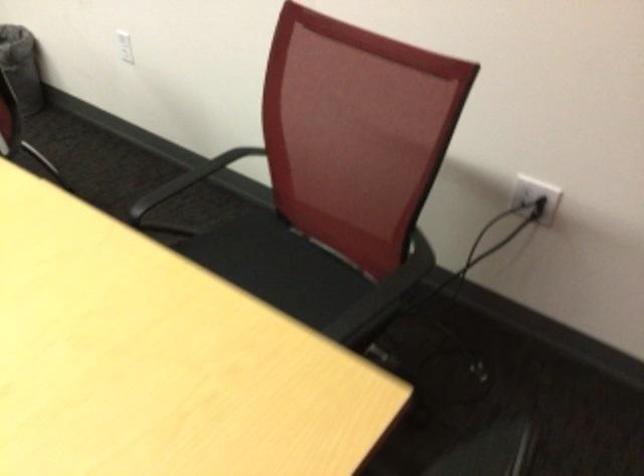
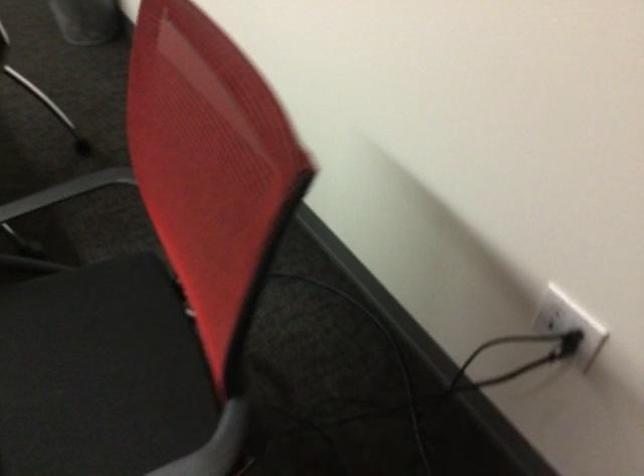
Find the pixel in the second image that matches (x=426, y=257) in the first image.

(221, 443)